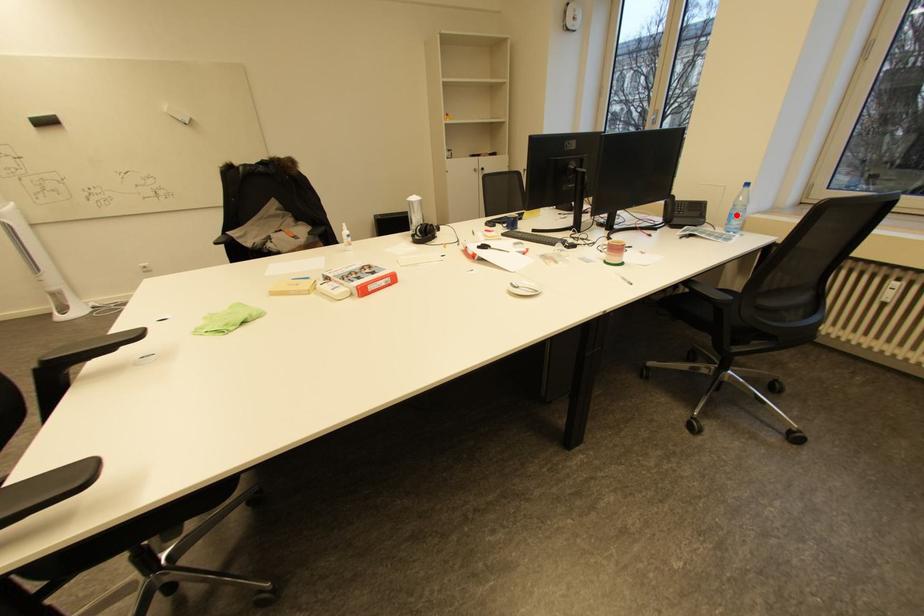
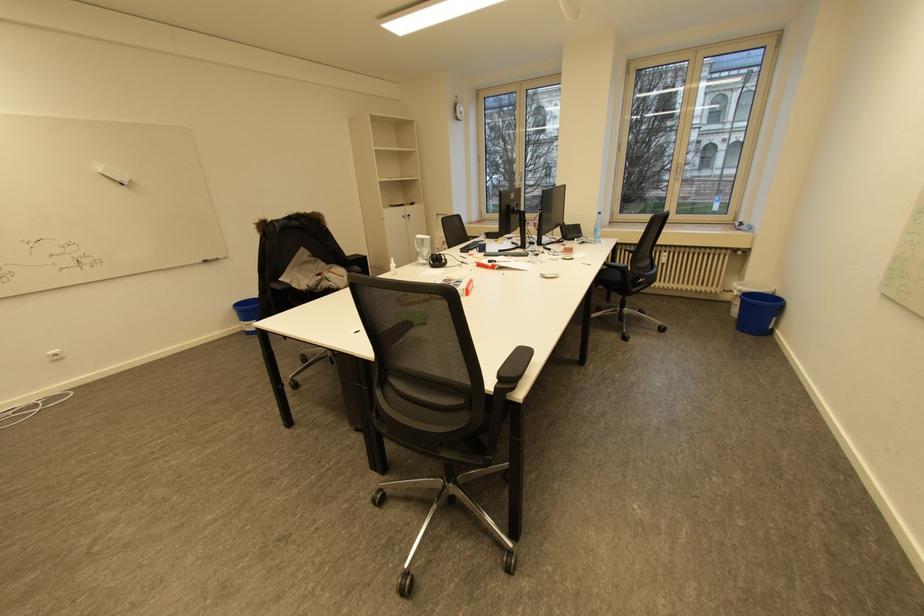
Where in the second image is the point corresponding to the highlighted location from the first image?

(601, 230)